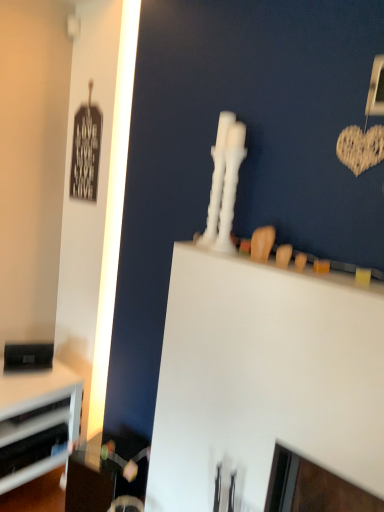
Question: Should I look upward or downward to see white plastic drawer at lower left, the 2th drawer positioned from the top?

Choices:
 (A) down
 (B) up

Answer: (A)

Question: Does white plastic drawer at lower left, the 2th drawer positioned from the top, have a lesser height compared to white matte computer desk at upper center?

Choices:
 (A) no
 (B) yes

Answer: (B)

Question: Could white matte computer desk at upper center be considered to be inside white plastic drawer at lower left, the 2th drawer positioned from the top?

Choices:
 (A) yes
 (B) no

Answer: (B)

Question: Is white plastic drawer at lower left, positioned as the first drawer in bottom-to-top order, to the right of white matte computer desk at upper center from the viewer's perspective?

Choices:
 (A) no
 (B) yes

Answer: (A)

Question: Does white plastic drawer at lower left, positioned as the first drawer in bottom-to-top order, have a larger size compared to white matte computer desk at upper center?

Choices:
 (A) no
 (B) yes

Answer: (A)

Question: From a real-world perspective, is white plastic drawer at lower left, positioned as the first drawer in bottom-to-top order, under white matte computer desk at upper center?

Choices:
 (A) no
 (B) yes

Answer: (B)

Question: Considering the relative sizes of white plastic drawer at lower left, the 2th drawer positioned from the top, and white matte computer desk at upper center in the image provided, is white plastic drawer at lower left, the 2th drawer positioned from the top, smaller than white matte computer desk at upper center?

Choices:
 (A) no
 (B) yes

Answer: (B)

Question: Is white matte computer desk at upper center facing towards brushed metal drawer at lower left, the 1th drawer in the top-to-bottom sequence?

Choices:
 (A) yes
 (B) no

Answer: (B)

Question: From a real-world perspective, is white matte computer desk at upper center positioned over brushed metal drawer at lower left, the 1th drawer in the top-to-bottom sequence, based on gravity?

Choices:
 (A) yes
 (B) no

Answer: (A)

Question: Is white matte computer desk at upper center further to the viewer compared to brushed metal drawer at lower left, the 1th drawer in the top-to-bottom sequence?

Choices:
 (A) yes
 (B) no

Answer: (B)

Question: From a real-world perspective, is white matte computer desk at upper center below brushed metal drawer at lower left, positioned as the second drawer in bottom-to-top order?

Choices:
 (A) no
 (B) yes

Answer: (A)

Question: From the image's perspective, is white matte computer desk at upper center below brushed metal drawer at lower left, positioned as the second drawer in bottom-to-top order?

Choices:
 (A) yes
 (B) no

Answer: (B)

Question: Is white matte computer desk at upper center positioned with its back to brushed metal drawer at lower left, the 1th drawer in the top-to-bottom sequence?

Choices:
 (A) yes
 (B) no

Answer: (B)

Question: Can you confirm if brushed metal drawer at lower left, positioned as the second drawer in bottom-to-top order, is smaller than black matte speaker at lower left?

Choices:
 (A) no
 (B) yes

Answer: (B)